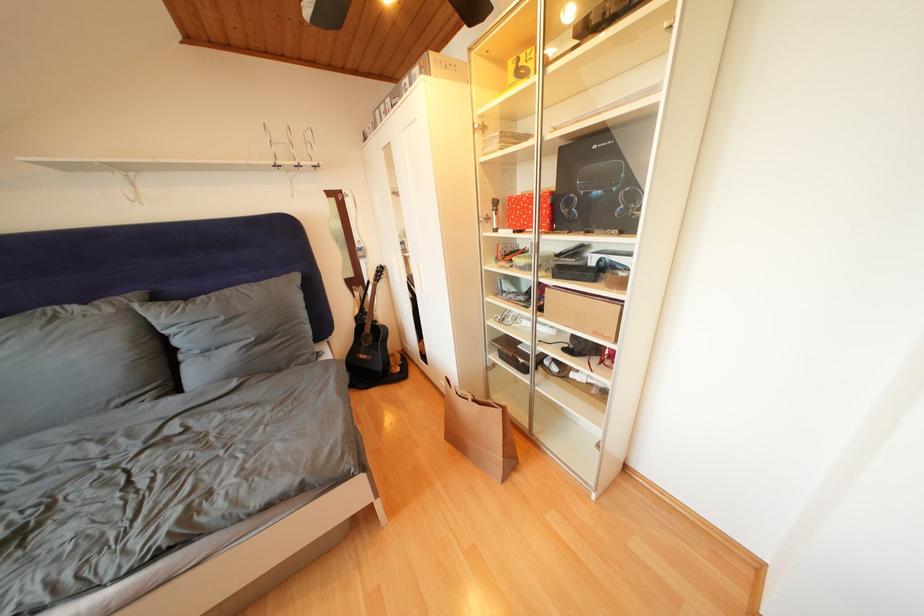
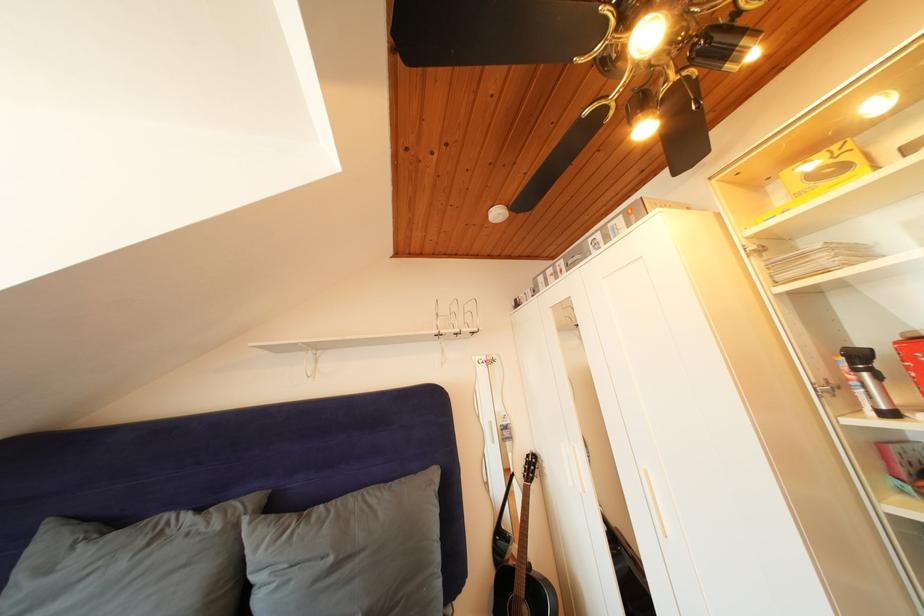
In the second image, find the point that corresponds to (495,224) in the first image.

(844, 392)